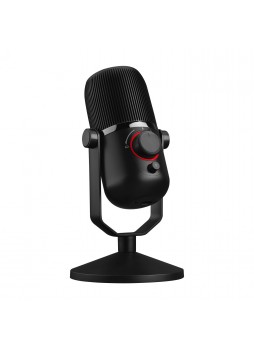
Locate an element on the screen. The image size is (254, 348). mic base is located at coordinates (125, 278).